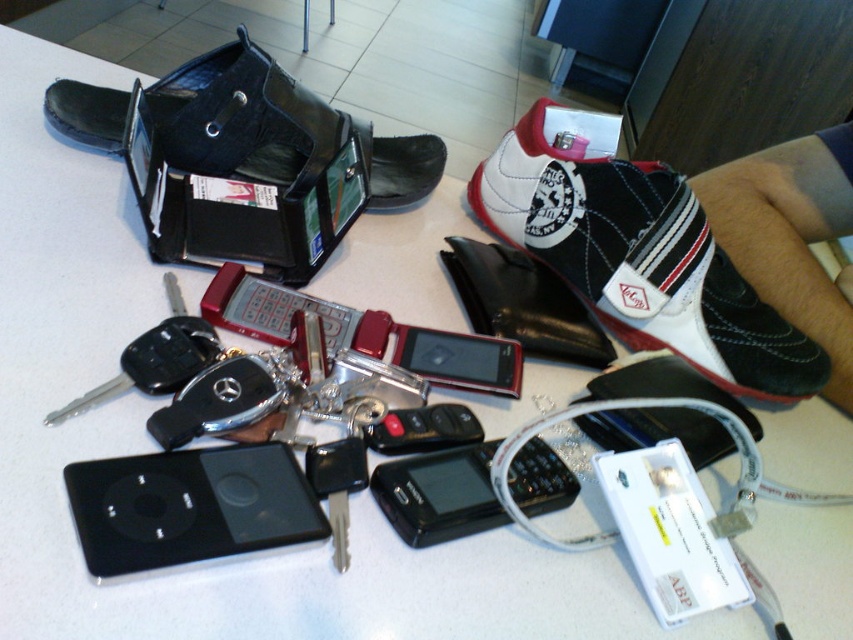
Question: Does black leather wallet at upper left appear on the right side of black matte smartphone at center?

Choices:
 (A) yes
 (B) no

Answer: (B)

Question: Which object is farther from the camera taking this photo?

Choices:
 (A) black matte/ipod at lower left
 (B) sleek black phone at center
 (C) black glossy smartphone at center

Answer: (B)

Question: Which object appears farthest from the camera in this image?

Choices:
 (A) black plastic ipod at lower center
 (B) white leather shoe at upper right

Answer: (B)

Question: Is black leather wallet at upper left to the left of black matte smartphone at center from the viewer's perspective?

Choices:
 (A) yes
 (B) no

Answer: (A)

Question: Does black matte/ipod at lower left have a greater width compared to sleek black phone at center?

Choices:
 (A) no
 (B) yes

Answer: (B)

Question: Which point is farther to the camera?

Choices:
 (A) (192, 513)
 (B) (466, 371)

Answer: (B)